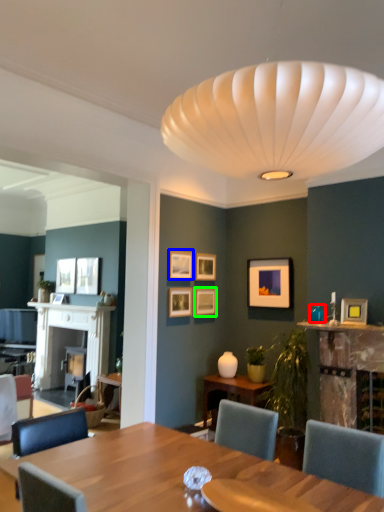
Question: Estimate the real-world distances between objects in this image. Which object is farther from teal (highlighted by a red box), picture frame (highlighted by a blue box) or picture frame (highlighted by a green box)?

Choices:
 (A) picture frame
 (B) picture frame

Answer: (A)